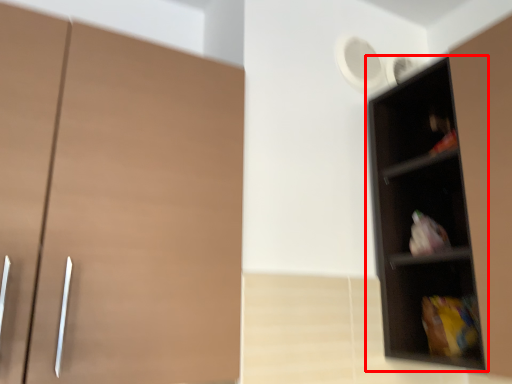
Question: From the image, what is the correct spatial relationship of shelf (annotated by the red box) in relation to cupboard?

Choices:
 (A) right
 (B) left

Answer: (A)